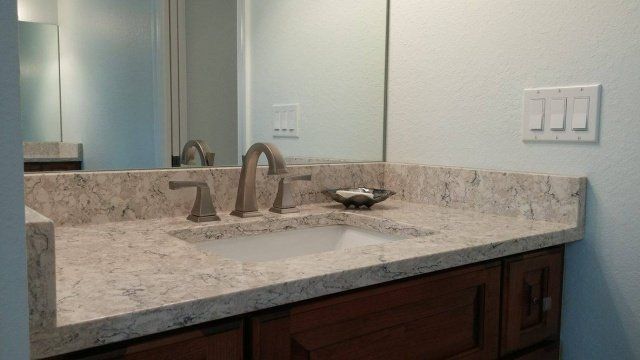
Identify the location of soap. (351, 196).